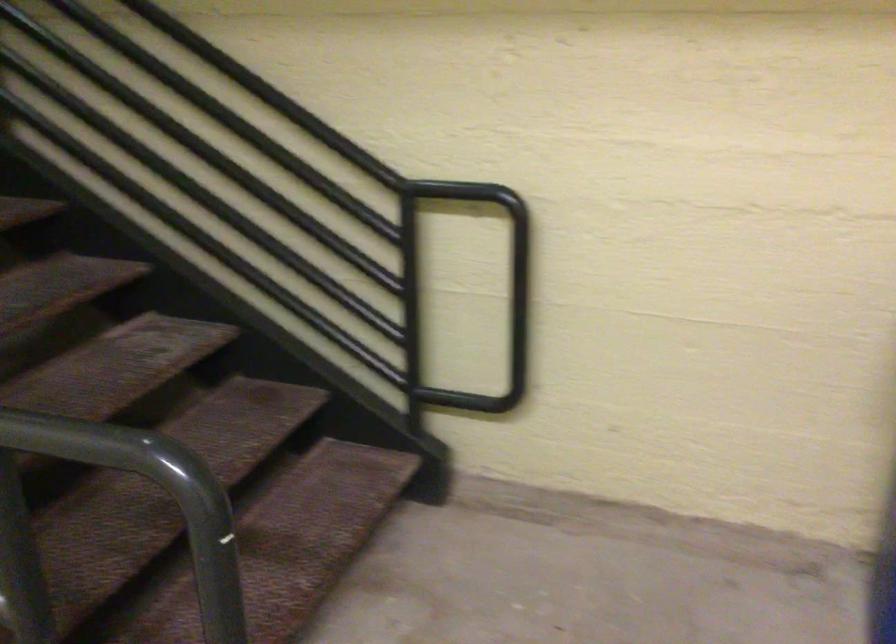
What do you see at coordinates (495, 301) in the screenshot?
I see `the curved metal railing` at bounding box center [495, 301].